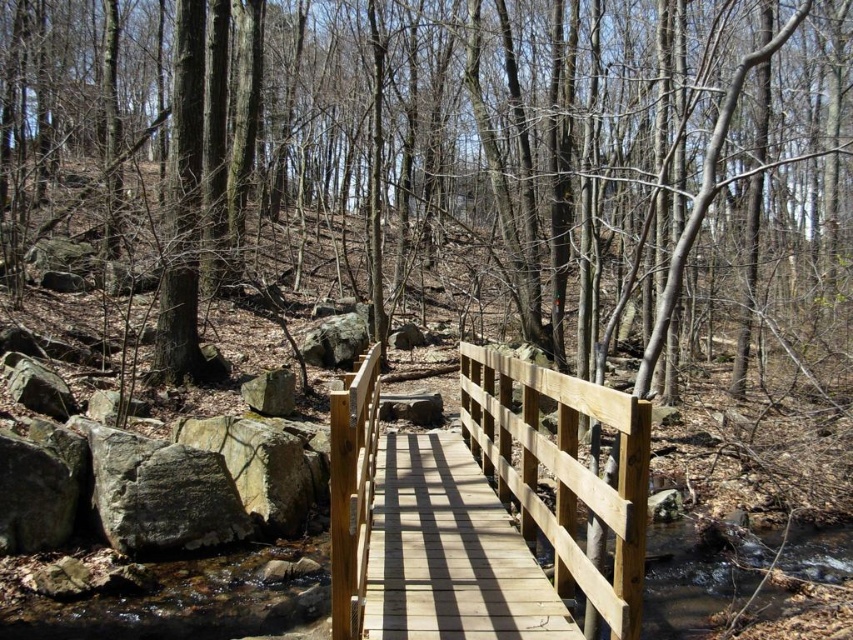
From the picture: You are a hiker carrying a backpack weighing 20 kilograms. You need to cross the natural wood bridge at center and the wooden bridge at center. Which bridge can support your weight better based on their widths?

The wooden bridge at center can support your weight better because it has a greater width than the natural wood bridge at center.

You are standing at the point marked by the coordinates point (450, 552) in the forest scene. What object are you directly on?

The point (450, 552) marks the wooden bridge at center, so you are directly on the wooden bridge at center.

You are standing on the wooden bridge in the forest and want to walk towards the point labeled as point (x=572, y=557). As you move forward, will you get closer to or farther away from the point labeled point (x=373, y=506)?

Since point (x=572, y=557) is in front of point (x=373, y=506), moving towards point (x=572, y=557) means you are getting closer to point (x=373, y=506) as well.